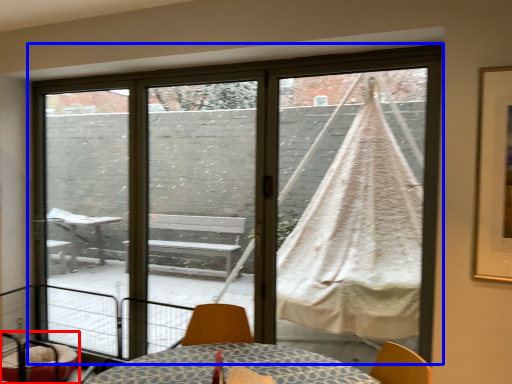
Question: Among these objects, which one is nearest to the camera, furniture (highlighted by a red box) or window (highlighted by a blue box)?

Choices:
 (A) furniture
 (B) window

Answer: (B)